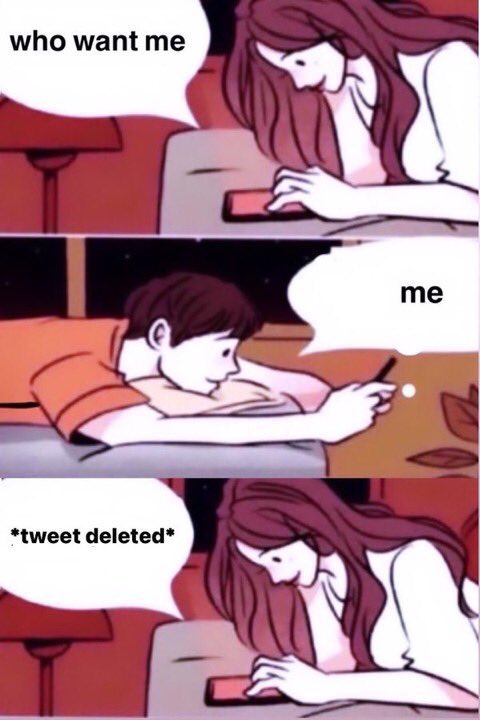
This screenshot has width=480, height=720. Identify the location of lamp. (47, 625), (63, 138).